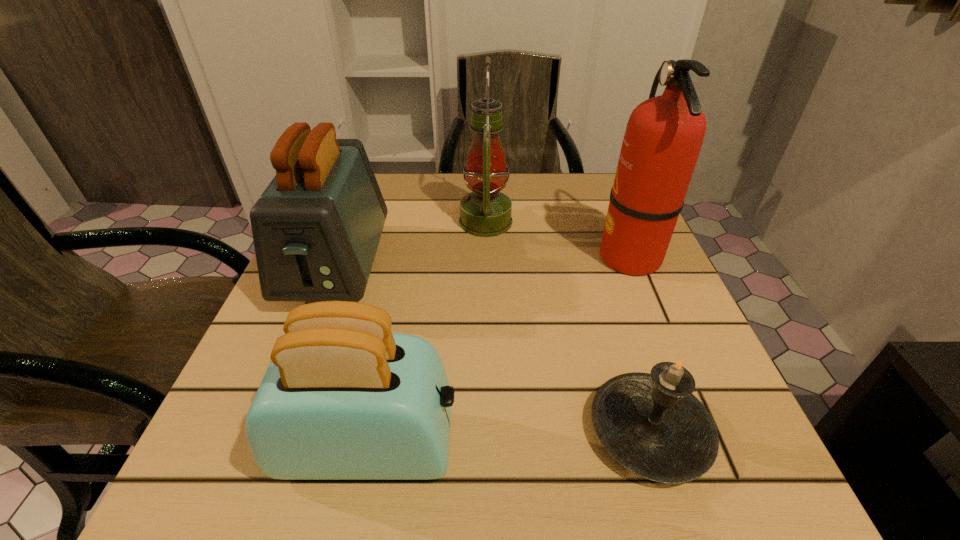
Where is `free space at the far edge`? This screenshot has height=540, width=960. free space at the far edge is located at coordinates pos(530,217).

This screenshot has width=960, height=540. In the image, there is a desktop. What are the coordinates of `vacant area at the near edge` in the screenshot? It's located at (626, 487).

The width and height of the screenshot is (960, 540). In the image, there is a desktop. In order to click on free space at the right edge in this screenshot , I will do 585,238.

At what (x,y) coordinates should I click in order to perform the action: click on free region at the near left corner. Please return your answer as a coordinate pair (x, y). The width and height of the screenshot is (960, 540). Looking at the image, I should click on (225, 474).

Find the location of a particular element. The height and width of the screenshot is (540, 960). vacant space at the far right corner of the desktop is located at coordinates (586, 207).

Identify the location of empty space between the farther toaster and the candle. The height and width of the screenshot is (540, 960). (493, 349).

Locate an element on the screen. Image resolution: width=960 pixels, height=540 pixels. vacant point located between the nearer toaster and the oil lamp is located at coordinates (428, 334).

Locate an element on the screen. free space between the fire extinguisher and the nearer toaster is located at coordinates (500, 351).

Identify the location of empty space between the shortest object and the fire extinguisher. (639, 344).

The width and height of the screenshot is (960, 540). I want to click on free space that is in between the oil lamp and the nearer toaster, so click(x=428, y=334).